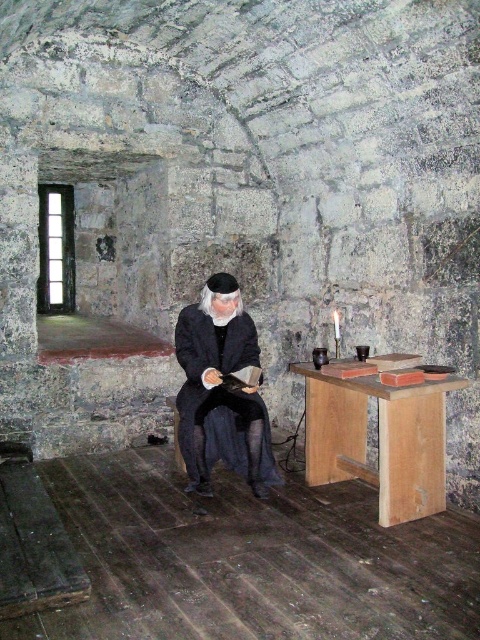
Question: Can you confirm if wooden table at center is positioned to the right of dark woolen robe at center?

Choices:
 (A) no
 (B) yes

Answer: (B)

Question: Among these points, which one is nearest to the camera?

Choices:
 (A) (250, 419)
 (B) (343, 432)

Answer: (A)

Question: Which of the following is the closest to the observer?

Choices:
 (A) dark woolen robe at center
 (B) wooden table at center

Answer: (B)

Question: Can you confirm if wooden table at center is wider than dark woolen robe at center?

Choices:
 (A) no
 (B) yes

Answer: (B)

Question: Can you confirm if wooden table at center is bigger than dark woolen robe at center?

Choices:
 (A) no
 (B) yes

Answer: (B)